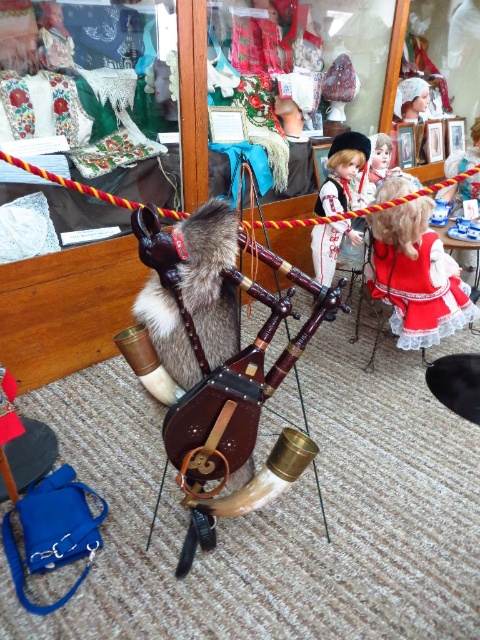
You are a visitor in a museum and see the point marked at coordinates (210, 276). What object is located at that point?

The point at coordinates (210, 276) corresponds to the fur covered animal at center.

You are a visitor standing in front of the display area. You see the red satin dress at center. Can you estimate its exact position in the display area using coordinates?

The red satin dress at center is located at coordinates point (x=420, y=291).